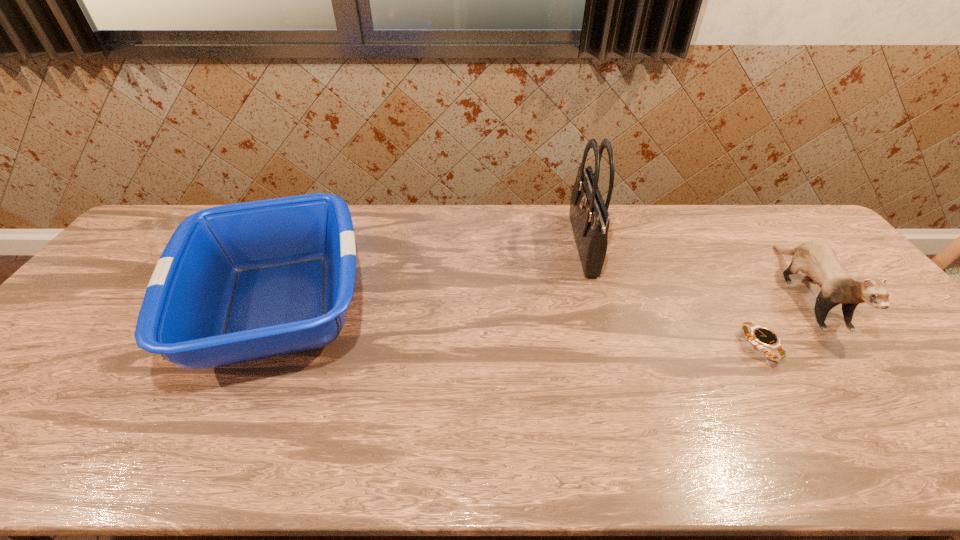
Identify the location of free space located 0.290m on the face of the rightmost object. The height and width of the screenshot is (540, 960). (938, 460).

This screenshot has height=540, width=960. Identify the location of free region located on the left of the third object from left to right. (726, 347).

Identify the location of handbag present at the far edge. (589, 215).

Locate an element on the screen. tray at the far edge is located at coordinates click(235, 283).

Find the location of `ferret present at the far edge`. ferret present at the far edge is located at coordinates (818, 260).

Identify the location of object that is at the right edge. (818, 260).

At what (x,y) coordinates should I click in order to perform the action: click on object located at the far right corner. Please return your answer as a coordinate pair (x, y). Looking at the image, I should click on (818, 260).

Identify the location of free region at the far edge of the desktop. (479, 218).

This screenshot has width=960, height=540. In the image, there is a desktop. Find the location of `vacant space at the near edge`. vacant space at the near edge is located at coordinates (377, 455).

Locate an element on the screen. Image resolution: width=960 pixels, height=540 pixels. free space at the left edge of the desktop is located at coordinates (78, 355).